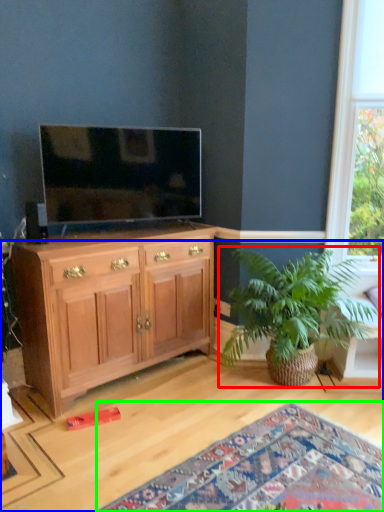
Question: Which object is positioned closest to houseplant (highlighted by a red box)? Select from desk (highlighted by a blue box) and plain (highlighted by a green box).

Choices:
 (A) desk
 (B) plain

Answer: (A)